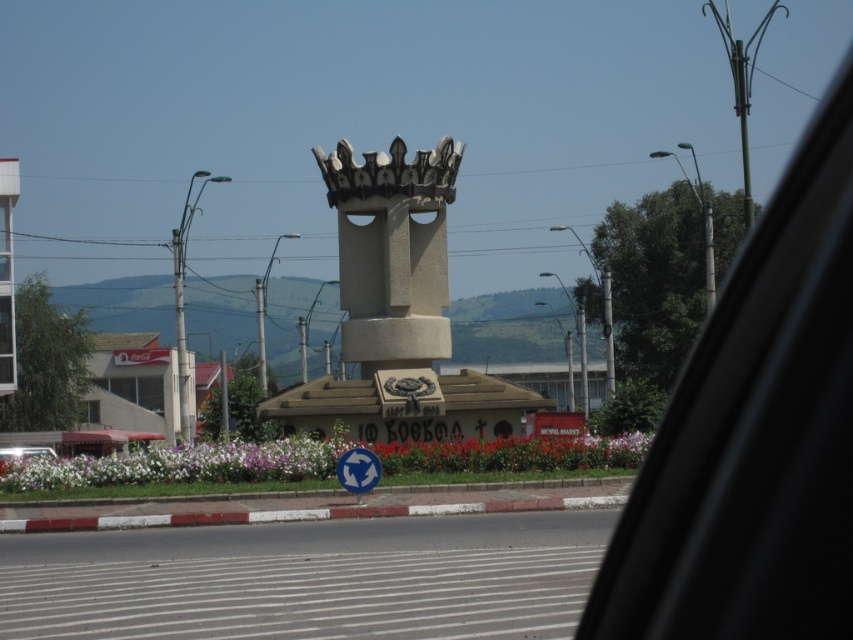
You are standing at the center of the roundabout and want to walk to both points marked in the image. Which point, point (827, 172) or point (358, 484), is closer to you?

Point (827, 172) is closer to the viewer than point (358, 484), so you should reach point (827, 172) first.

You are a passenger in a car and want to take a photo of the monument in the center of the roundabout. Which object, the transparent glass car window at upper right or the metallic silver car at lower left, offers a wider view to capture the monument?

The transparent glass car window at upper right might be wider than metallic silver car at lower left, so it could provide a better view to capture the monument.

You are standing at the roundabout and want to reach the monument at the center. You see two points marked as point 1 and point 2. Point 1 is at coordinates point (846, 468) and point 2 is at coordinates point (10, 458). Which point is closer to the monument?

Point 1 is closer to the monument because it is in front of point 2.